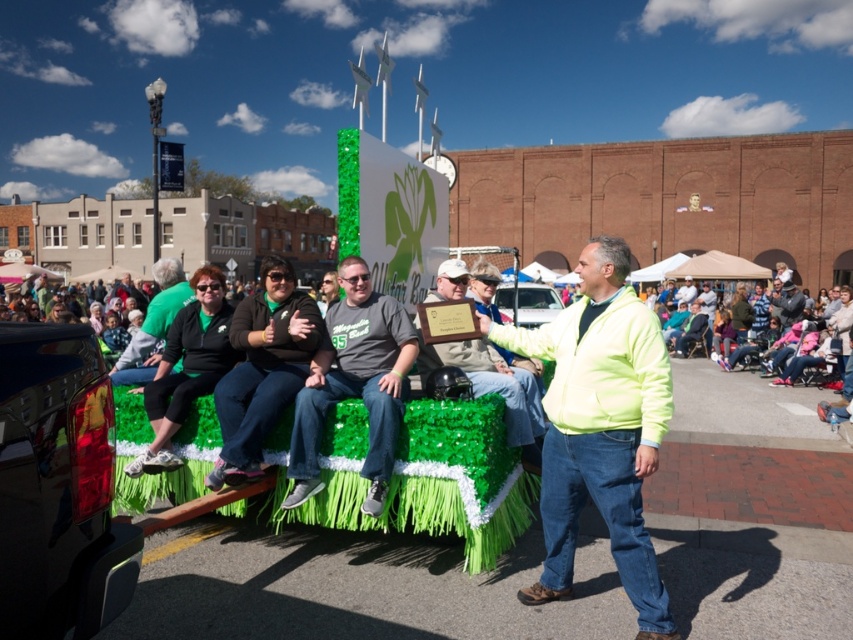
Is matte gray shirt at center wider than matte green helmet at center?

No.

Which is more to the left, matte gray shirt at center or matte green helmet at center?

Positioned to the left is matte gray shirt at center.

This screenshot has height=640, width=853. Describe the element at coordinates (354, 384) in the screenshot. I see `matte gray shirt at center` at that location.

The height and width of the screenshot is (640, 853). I want to click on matte gray shirt at center, so click(x=354, y=384).

Who is positioned more to the right, matte green fabric at center or matte green helmet at center?

Positioned to the right is matte green helmet at center.

Is point (260, 372) positioned before point (492, 358)?

Yes.

I want to click on matte green fabric at center, so click(x=262, y=369).

The height and width of the screenshot is (640, 853). What do you see at coordinates (494, 388) in the screenshot? I see `matte green helmet at center` at bounding box center [494, 388].

Can you confirm if matte green helmet at center is wider than matte green shirt at center?

Correct, the width of matte green helmet at center exceeds that of matte green shirt at center.

Where is `matte green helmet at center`? This screenshot has height=640, width=853. matte green helmet at center is located at coordinates (494, 388).